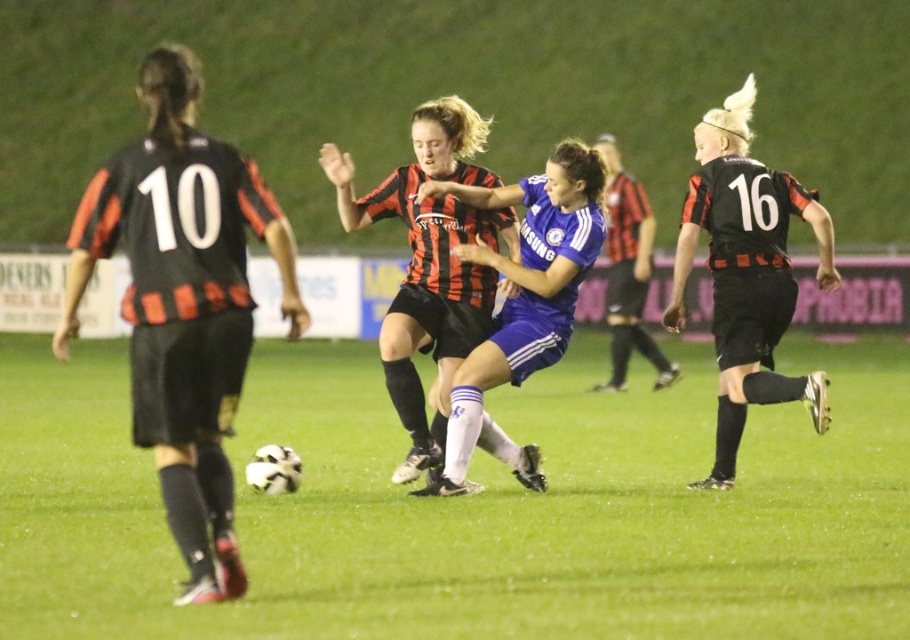
You are a soccer player positioned at the edge of the field and want to pass the ball to your teammate wearing the matte black jersey at center. The ball is currently on the green grass football field at center. Which direction should you move to ensure the ball reaches your teammate?

The green grass football field at center is to the left of the matte black jersey at center, so you should move to the right to position the ball towards your teammate.